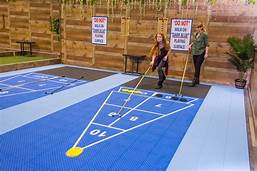
Where is `plant at the right corner of the room`? Image resolution: width=257 pixels, height=171 pixels. plant at the right corner of the room is located at coordinates (239, 82).